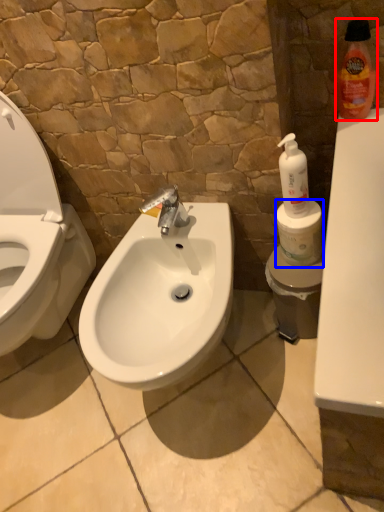
Question: Which object appears closest to the camera in this image, cleaning product (highlighted by a red box) or toilet paper (highlighted by a blue box)?

Choices:
 (A) cleaning product
 (B) toilet paper

Answer: (A)